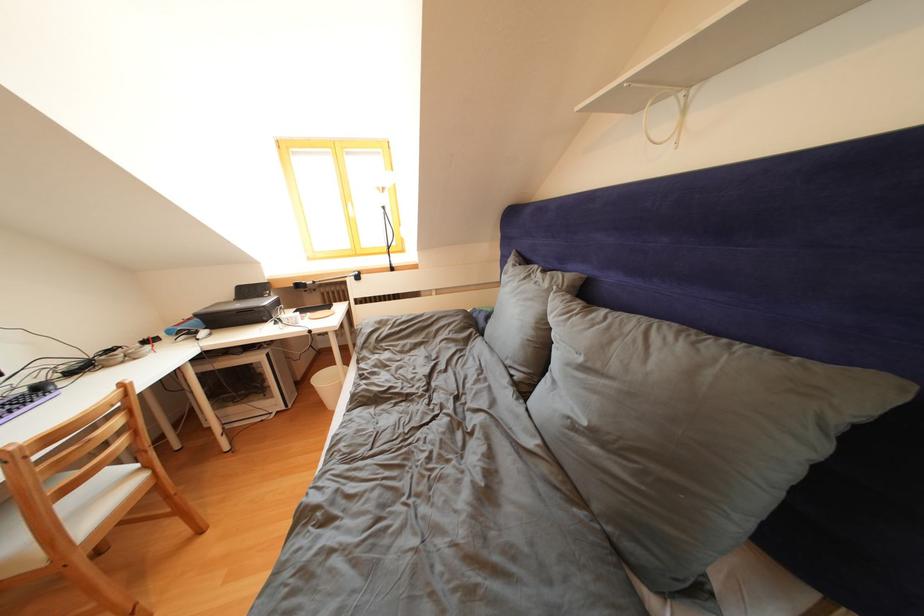
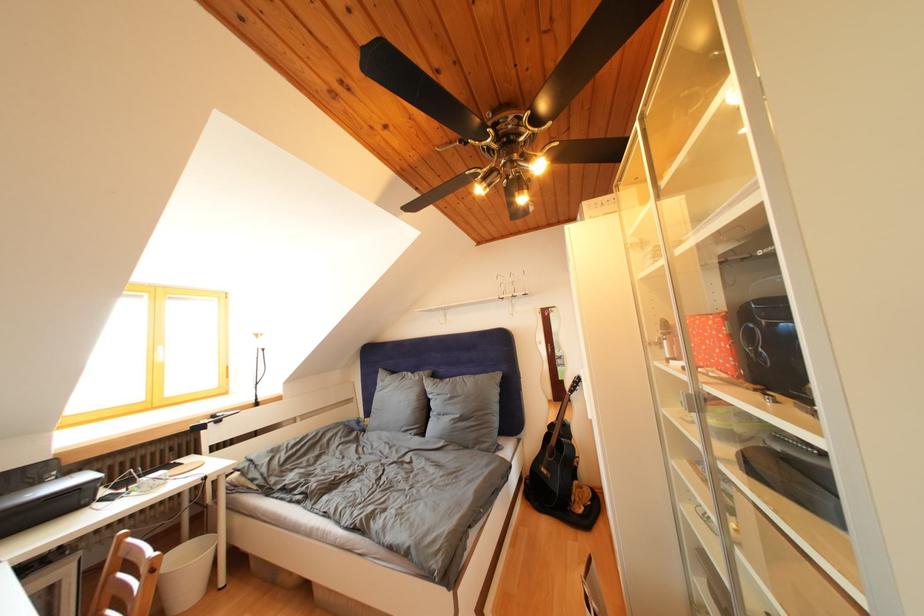
Find the pixel in the second image that matches [269,301] in the first image.

(44, 488)